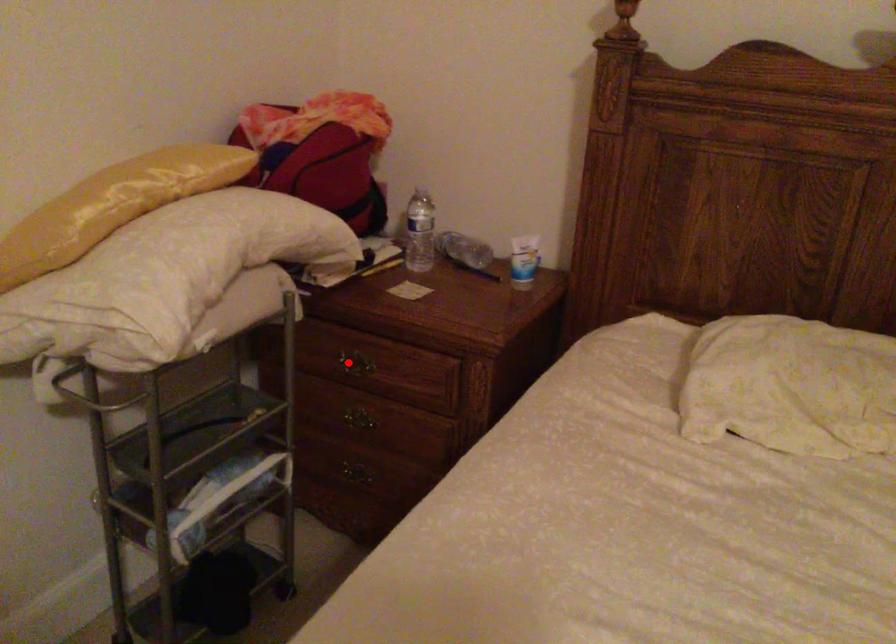
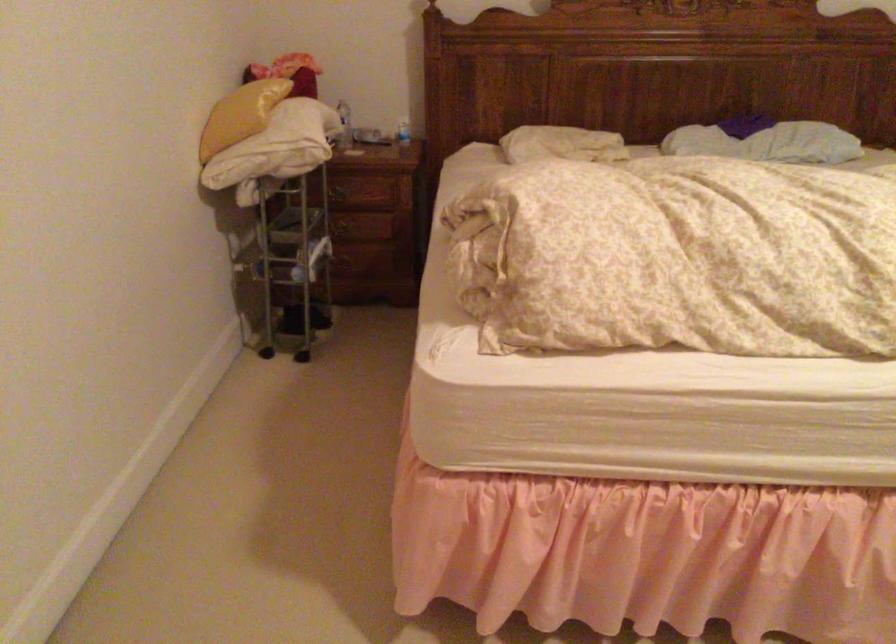
Where in the second image is the point corresponding to the highlighted location from the first image?

(338, 194)